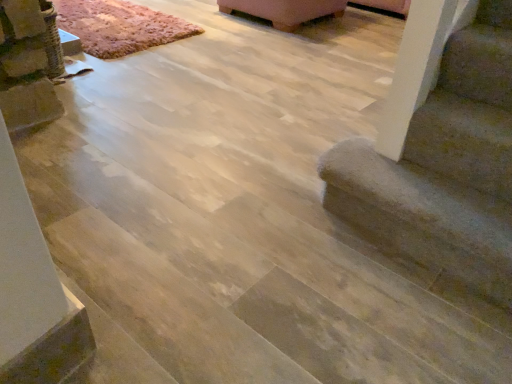
Question: Can you confirm if rustic wool rug at upper left is positioned to the left of smooth concrete stairs at lower right?

Choices:
 (A) no
 (B) yes

Answer: (B)

Question: Is rustic wool rug at upper left closer to the viewer compared to smooth concrete stairs at lower right?

Choices:
 (A) no
 (B) yes

Answer: (A)

Question: Considering the relative positions of rustic wool rug at upper left and smooth concrete stairs at lower right in the image provided, is rustic wool rug at upper left to the right of smooth concrete stairs at lower right from the viewer's perspective?

Choices:
 (A) no
 (B) yes

Answer: (A)

Question: From a real-world perspective, does rustic wool rug at upper left stand above smooth concrete stairs at lower right?

Choices:
 (A) no
 (B) yes

Answer: (A)

Question: Could you tell me if rustic wool rug at upper left is turned towards smooth concrete stairs at lower right?

Choices:
 (A) no
 (B) yes

Answer: (A)

Question: Does rustic wool rug at upper left have a larger size compared to smooth concrete stairs at lower right?

Choices:
 (A) no
 (B) yes

Answer: (B)

Question: Does smooth concrete stairs at lower right lie in front of rustic wool rug at upper left?

Choices:
 (A) no
 (B) yes

Answer: (B)

Question: Can you confirm if smooth concrete stairs at lower right is taller than rustic wool rug at upper left?

Choices:
 (A) yes
 (B) no

Answer: (A)

Question: Is smooth concrete stairs at lower right to the right of rustic wool rug at upper left from the viewer's perspective?

Choices:
 (A) no
 (B) yes

Answer: (B)

Question: Does smooth concrete stairs at lower right appear on the left side of rustic wool rug at upper left?

Choices:
 (A) yes
 (B) no

Answer: (B)

Question: Can you confirm if smooth concrete stairs at lower right is wider than rustic wool rug at upper left?

Choices:
 (A) yes
 (B) no

Answer: (B)

Question: Is smooth concrete stairs at lower right located outside rustic wool rug at upper left?

Choices:
 (A) no
 (B) yes

Answer: (B)

Question: Relative to rustic wool rug at upper left, is smooth concrete stairs at lower right in front or behind?

Choices:
 (A) front
 (B) behind

Answer: (A)